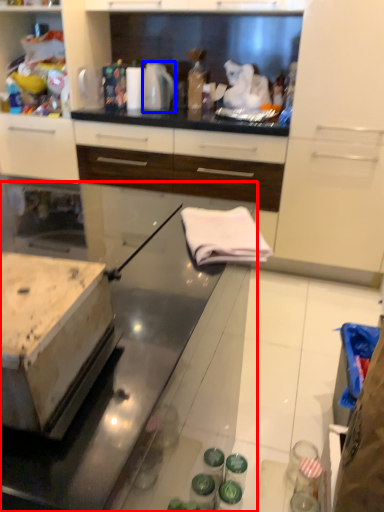
Question: Which object is further to the camera taking this photo, countertop (highlighted by a red box) or kitchen appliance (highlighted by a blue box)?

Choices:
 (A) countertop
 (B) kitchen appliance

Answer: (B)